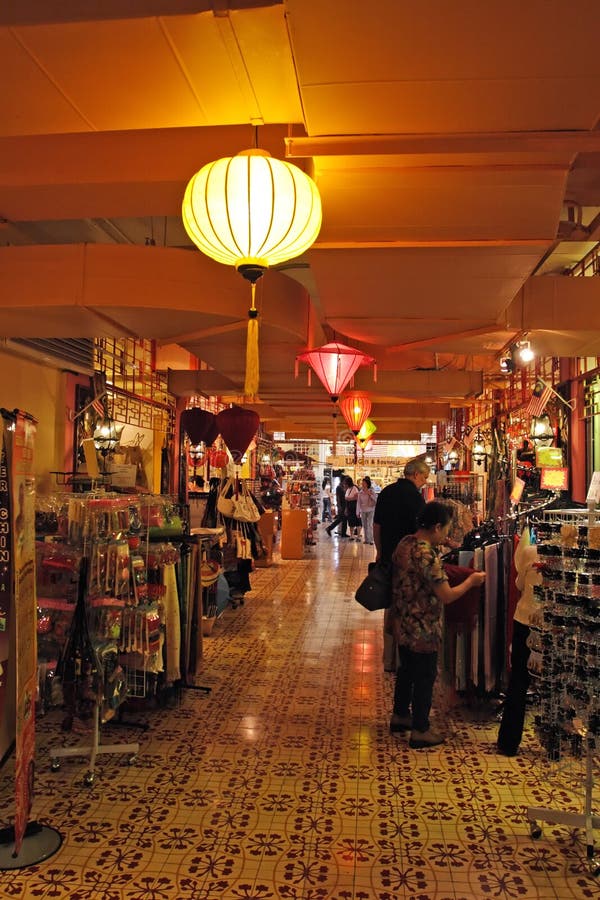
Locate an element on the screen. This screenshot has width=600, height=900. pink lantern is located at coordinates (335, 366).